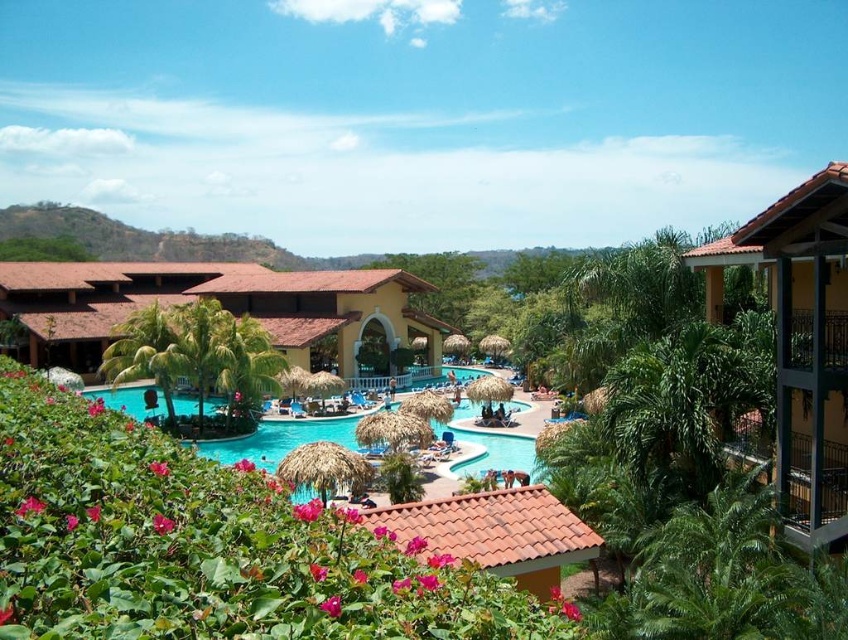
You are a guest at the resort and want to take a photo of the turquoise glossy water at center from the yellow stucco balcony at upper right. Considering the balcony is narrow, will you have enough space to move around comfortably while taking the photo?

The yellow stucco balcony at upper right is narrower than the turquoise glossy water at center, so there might not be enough space to move around comfortably while taking the photo.

In the scene shown: You are a guest staying at the resort and want to take a photo of the matte yellow building at center from the turquoise glossy water at center. Is the building visible from the water area?

The matte yellow building at center is located above the turquoise glossy water at center, so yes, the building is visible from the water area.

You are standing at the entrance of the resort and want to locate the matte yellow building at center. According to the coordinates provided, where should you look relative to your current position?

The matte yellow building at center is located at coordinates point (227, 308), which means it is slightly to the right and a bit below your current line of sight. To find it, look towards the central area of the resort, slightly to the right and downward from your current position.